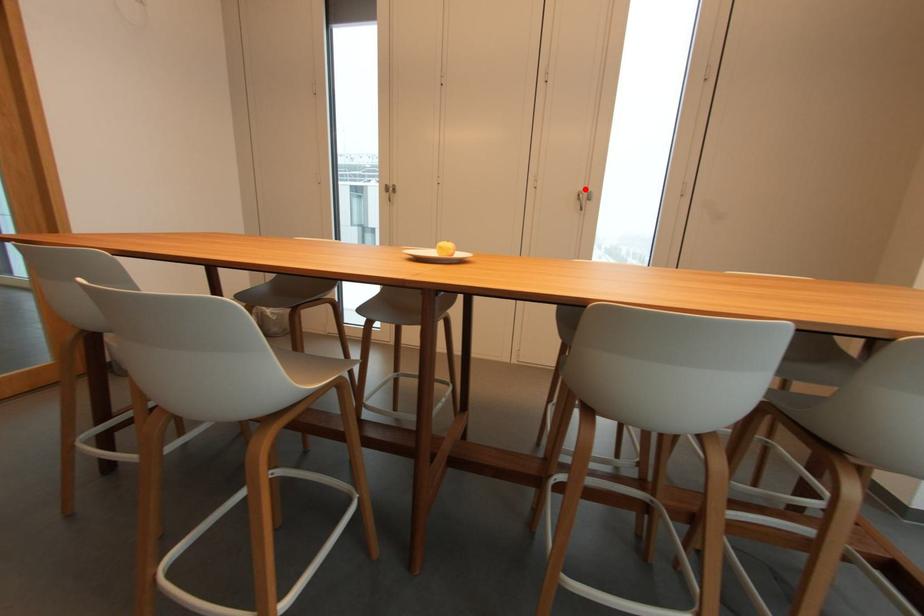
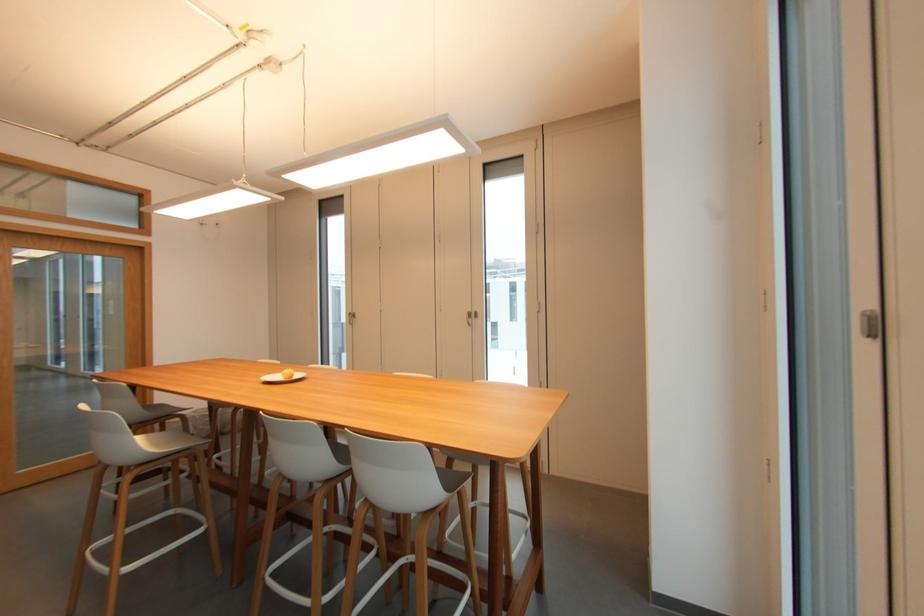
Question: A red point is marked in image1. In image2, is the corresponding 3D point closer to the camera or farther? Reply with the corresponding letter.

Choices:
 (A) The corresponding 3D point is closer.
 (B) The corresponding 3D point is farther.

Answer: (B)